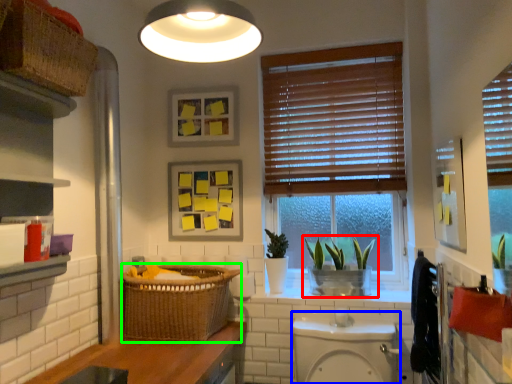
Question: Which is nearer to the houseplant (highlighted by a red box)? toilet bowl (highlighted by a blue box) or basket (highlighted by a green box).

Choices:
 (A) toilet bowl
 (B) basket

Answer: (A)